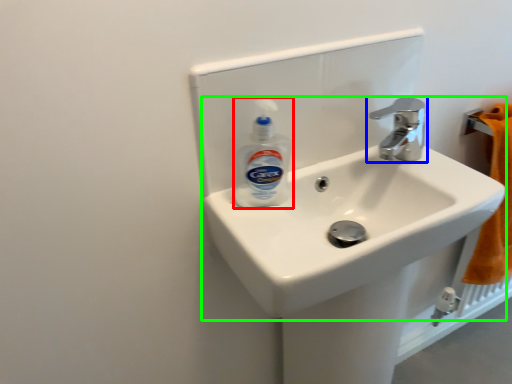
Question: Which is nearer to the cleaning product (highlighted by a red box)? tap (highlighted by a blue box) or sink (highlighted by a green box).

Choices:
 (A) tap
 (B) sink

Answer: (B)